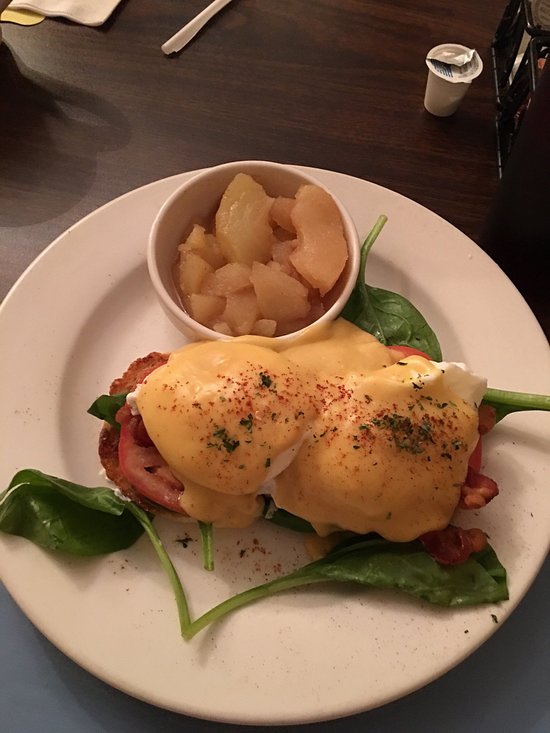
The height and width of the screenshot is (733, 550). Identify the location of plate shadow. (x=124, y=721).